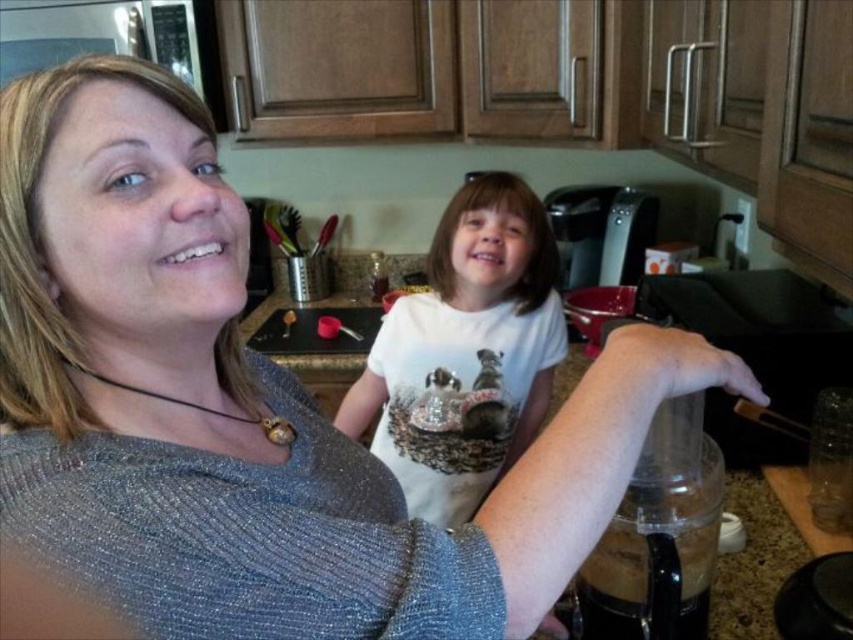
You are a tailor who needs to determine if a white cotton shirt at center can be fully displayed on a granite countertop at center. Based on the scene, can the shirt be displayed without any part of it hanging off the edge?

The white cotton shirt at center is taller than the granite countertop at center, so it cannot be fully displayed without part of it hanging off the edge.

You are a chef preparing to place a white cotton shirt at center on the granite countertop at center. According to the scene description, can the shirt be placed there without overlapping the countertop?

The white cotton shirt at center is already positioned under the granite countertop at center, so placing it there would not cause any overlap with the countertop.

You are a photographer standing in the kitchen scene. You want to take a closeup photo of the white cotton shirt at center. The camera you are using has a minimum focusing distance of 5 feet. Will you be able to take the photo without moving the camera closer?

The distance between the white cotton shirt at center and the camera is 4.73 feet, which is less than the minimum focusing distance of 5 feet. Therefore, you cannot take the photo without moving the camera closer.